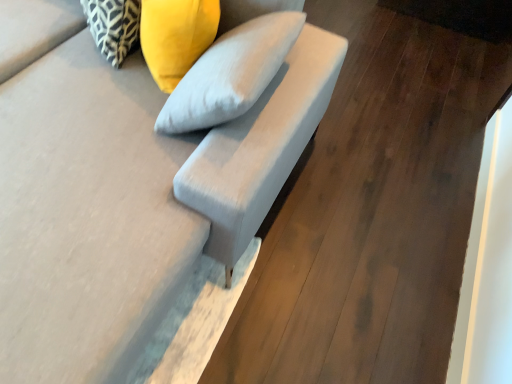
Question: From a real-world perspective, is yellow fabric pillow at upper center, which ranks as the second pillow in left-to-right order, physically below suede-like gray armchair at center?

Choices:
 (A) yes
 (B) no

Answer: (B)

Question: Would you say yellow fabric pillow at upper center, the first pillow from the right, is outside suede-like gray armchair at center?

Choices:
 (A) yes
 (B) no

Answer: (B)

Question: From the image's perspective, is yellow fabric pillow at upper center, the first pillow from the right, on suede-like gray armchair at center?

Choices:
 (A) no
 (B) yes

Answer: (B)

Question: Can you confirm if yellow fabric pillow at upper center, the first pillow from the right, is taller than suede-like gray armchair at center?

Choices:
 (A) yes
 (B) no

Answer: (B)

Question: From a real-world perspective, is yellow fabric pillow at upper center, the first pillow from the right, on top of suede-like gray armchair at center?

Choices:
 (A) yes
 (B) no

Answer: (A)

Question: Is yellow fabric pillow at upper center, which ranks as the second pillow in left-to-right order, further to the viewer compared to suede-like gray armchair at center?

Choices:
 (A) yes
 (B) no

Answer: (A)

Question: From the image's perspective, is suede-like gray armchair at center under suede gray sofa at center?

Choices:
 (A) yes
 (B) no

Answer: (B)

Question: Is suede-like gray armchair at center far from suede gray sofa at center?

Choices:
 (A) yes
 (B) no

Answer: (B)

Question: Does suede-like gray armchair at center turn towards suede gray sofa at center?

Choices:
 (A) yes
 (B) no

Answer: (A)

Question: From a real-world perspective, is suede-like gray armchair at center over suede gray sofa at center?

Choices:
 (A) yes
 (B) no

Answer: (A)

Question: From the image's perspective, does suede-like gray armchair at center appear higher than suede gray sofa at center?

Choices:
 (A) yes
 (B) no

Answer: (A)

Question: Does suede-like gray armchair at center have a greater width compared to suede gray sofa at center?

Choices:
 (A) no
 (B) yes

Answer: (A)

Question: Does patterned fabric pillow at upper left, acting as the first pillow starting from the left, have a greater height compared to suede gray sofa at center?

Choices:
 (A) no
 (B) yes

Answer: (A)